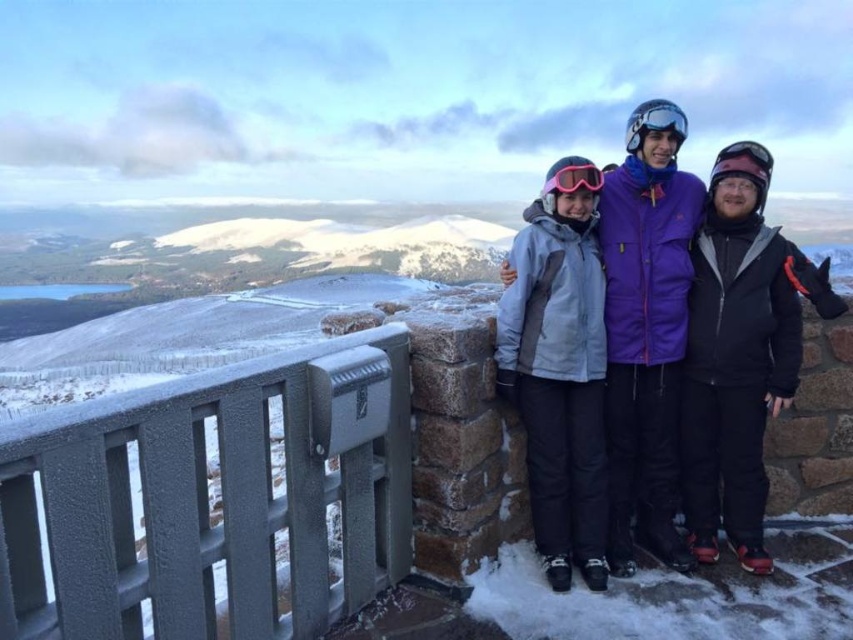
You are a photographer planning to take a group photo of the three people at the point (625, 456). The minimum distance required between the photographer and the subjects for a clear shot is 20 feet. Can you safely take the photo from your current position?

The subjects are 20.87 feet away from the photographer, which exceeds the minimum required distance of 20 feet. Therefore, you can safely take the photo from your current position.

You are standing at the center of the image. Which direction should you move to reach the gray plastic rail at left?

You should move to the left to reach the gray plastic rail at left since it is located at the left side of the image.